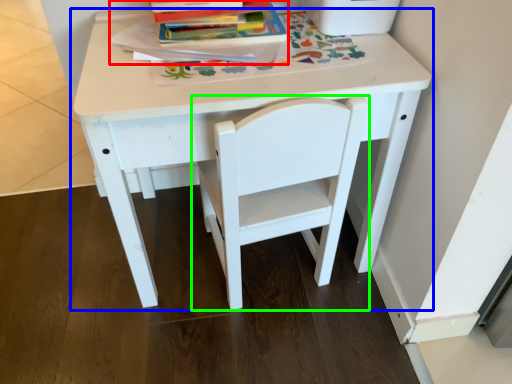
Question: Which is farther away from paperback book (highlighted by a red box)? table (highlighted by a blue box) or chair (highlighted by a green box)?

Choices:
 (A) table
 (B) chair

Answer: (B)